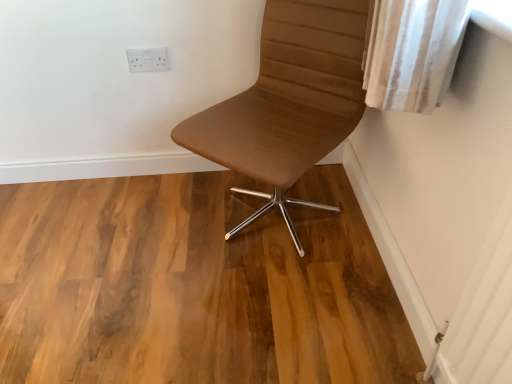
Locate an element on the screen. This screenshot has width=512, height=384. free space above natural wood floor at center (from a real-world perspective) is located at coordinates (160, 240).